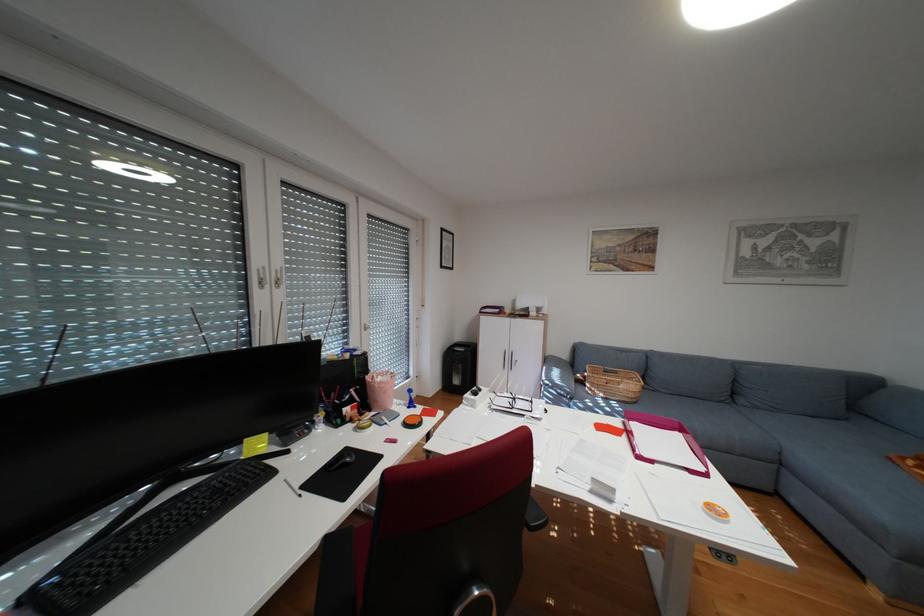
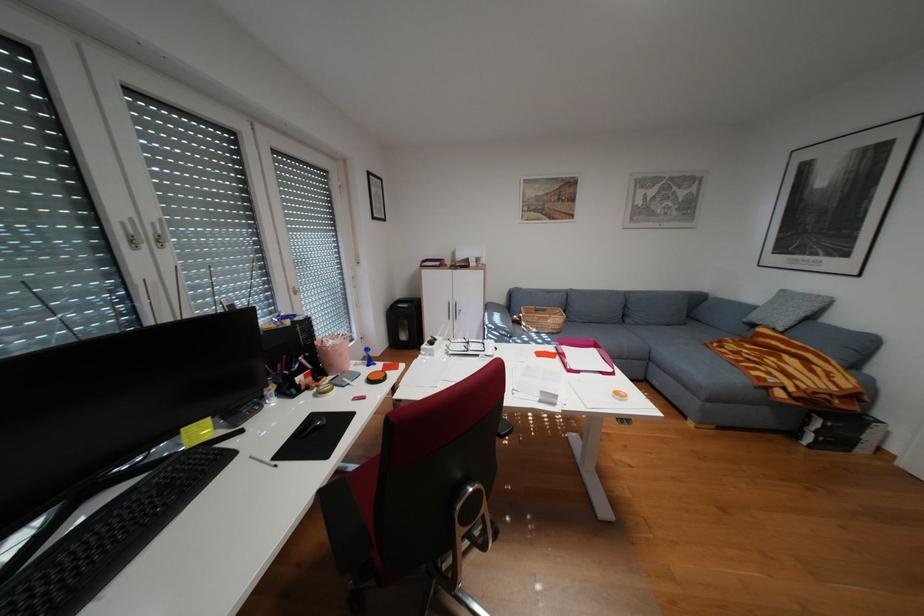
In the second image, find the point that corresponds to [664,461] in the first image.

(590, 371)